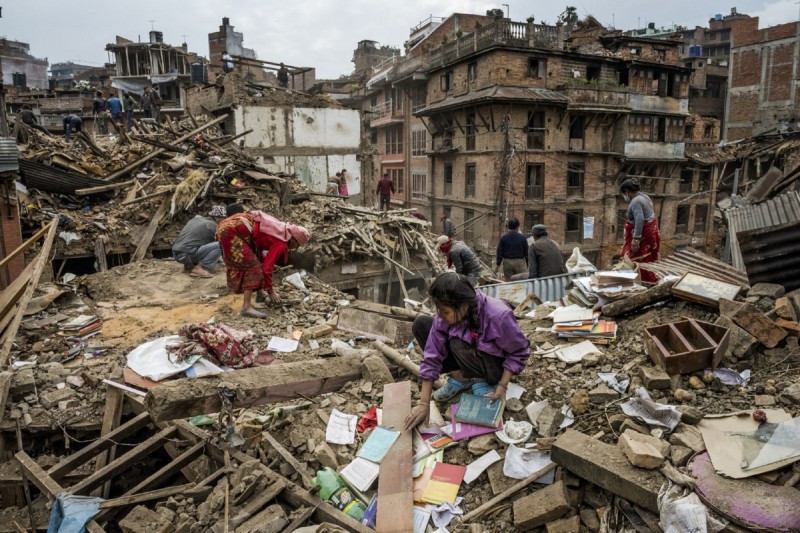
I want to click on window, so click(448, 174).